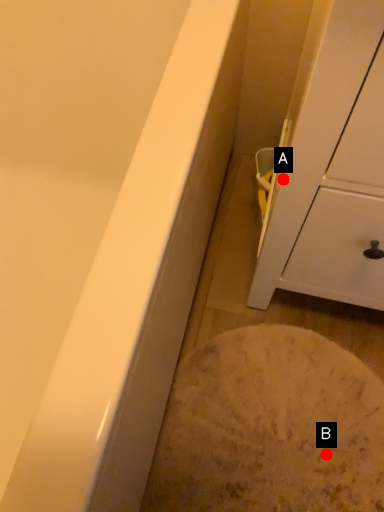
Question: Two points are circled on the image, labeled by A and B beside each circle. Among these points, which one is farthest from the camera?

Choices:
 (A) A is further
 (B) B is further

Answer: (B)